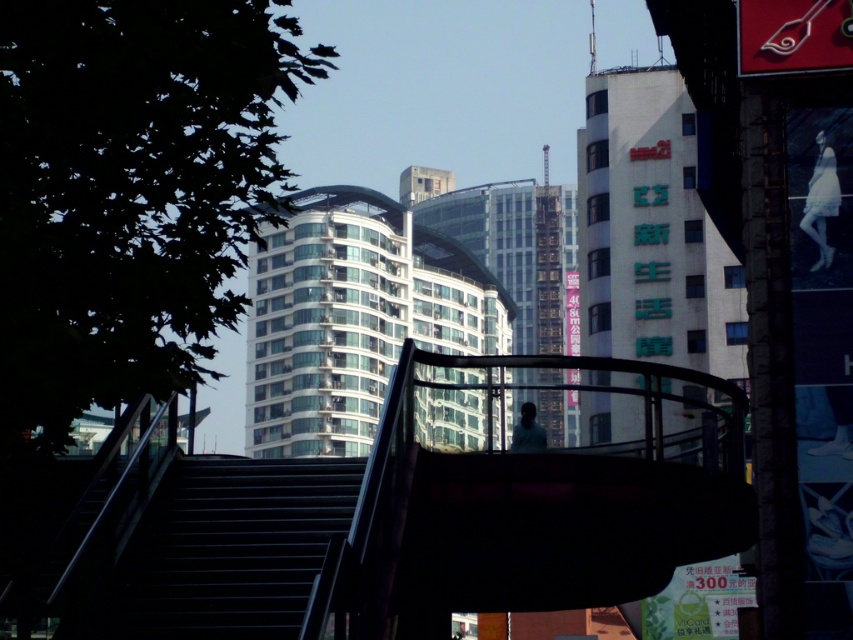
Between white lace dress at upper right and light blue fabric person at center, which one has less height?

white lace dress at upper right

What do you see at coordinates (821, 200) in the screenshot?
I see `white lace dress at upper right` at bounding box center [821, 200].

Between point (828, 192) and point (529, 429), which one is positioned behind?

Point (828, 192)

Identify the location of white lace dress at upper right. (821, 200).

Does black metal stairs at center lie in front of white lace dress at upper right?

That is True.

Can you confirm if black metal stairs at center is wider than white lace dress at upper right?

Yes, black metal stairs at center is wider than white lace dress at upper right.

Is point (300, 566) positioned behind point (837, 195)?

No, (300, 566) is in front of (837, 195).

What are the coordinates of `black metal stairs at center` in the screenshot? It's located at (224, 550).

Is black metal stairs at center smaller than light blue fabric person at center?

Actually, black metal stairs at center might be larger than light blue fabric person at center.

Between black metal stairs at center and light blue fabric person at center, which one appears on the left side from the viewer's perspective?

black metal stairs at center

Is point (280, 596) positioned behind point (537, 429)?

No, (280, 596) is closer to viewer.

You are a GUI agent. You are given a task and a screenshot of the screen. Output one action in this format:
    pyautogui.click(x=<x>, y=<y>)
    Task: Click on the black metal stairs at center
    
    Given the screenshot: What is the action you would take?
    pyautogui.click(x=224, y=550)